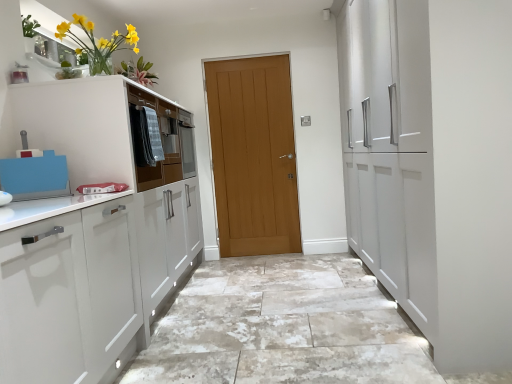
Locate an element on the screen. free space underneath light brown wooden door at center (from a real-world perspective) is located at coordinates (261, 256).